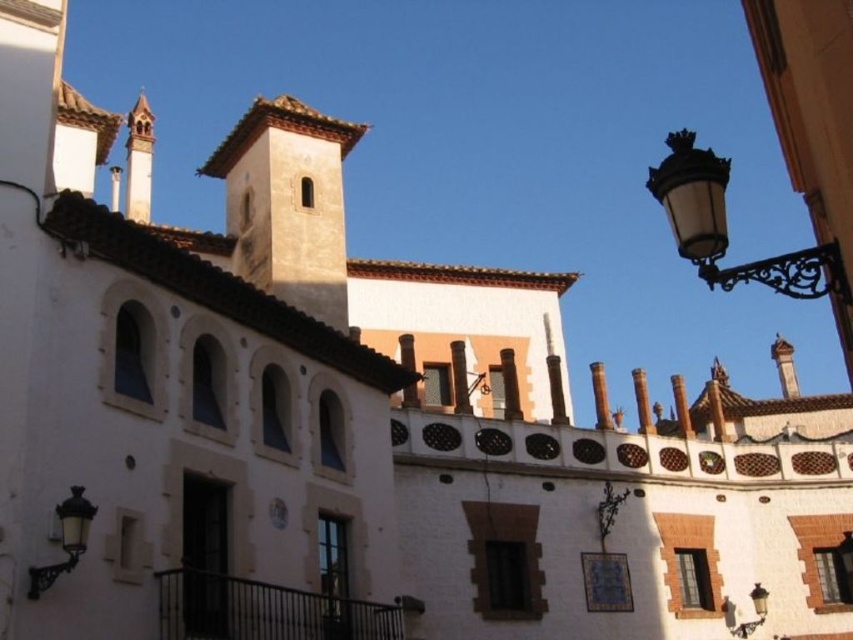
You are standing in front of the historic building and want to take a photo. You notice two points marked on the building facade. The first point is at coordinate point [701,241] and the second is at point [757,596]. Which point appears closer to you when looking at the building?

Point [701,241] is closer to the camera than point [757,596], so when looking at the building, the first point appears closer to you.

You are standing in front of the historic building and want to know if the black wrought iron streetlight at upper right is above the metallic clock at center. Can you confirm this?

Yes, the black wrought iron streetlight at upper right is positioned over the metallic clock at center, so it is indeed above the clock.